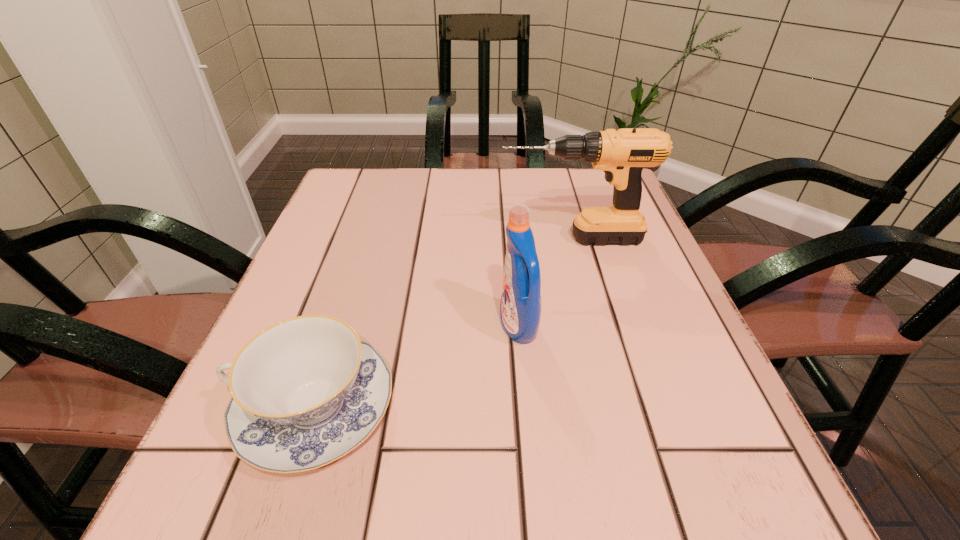
I want to click on object that is at the near edge, so click(x=306, y=391).

Locate an element on the screen. object situated at the left edge is located at coordinates coord(306,391).

Identify the location of object that is positioned at the right edge. (622, 155).

Locate an element on the screen. The width and height of the screenshot is (960, 540). object present at the near left corner is located at coordinates (306, 391).

At what (x,y) coordinates should I click in order to perform the action: click on vacant space at the far edge of the desktop. Please return your answer as a coordinate pair (x, y). The height and width of the screenshot is (540, 960). Looking at the image, I should click on (540, 195).

At what (x,y) coordinates should I click in order to perform the action: click on vacant space at the left edge of the desktop. Please return your answer as a coordinate pair (x, y). The width and height of the screenshot is (960, 540). Looking at the image, I should click on (309, 259).

You are a GUI agent. You are given a task and a screenshot of the screen. Output one action in this format:
    pyautogui.click(x=<x>, y=<y>)
    Task: Click on the free space at the right edge of the desktop
    
    Given the screenshot: What is the action you would take?
    pyautogui.click(x=678, y=293)

You are a GUI agent. You are given a task and a screenshot of the screen. Output one action in this format:
    pyautogui.click(x=<x>, y=<y>)
    Task: Click on the vacant area at the far left corner
    The height and width of the screenshot is (540, 960).
    Given the screenshot: What is the action you would take?
    pyautogui.click(x=375, y=179)

Where is `vacant space at the near left corner of the desktop`? This screenshot has width=960, height=540. vacant space at the near left corner of the desktop is located at coordinates (228, 500).

You are a GUI agent. You are given a task and a screenshot of the screen. Output one action in this format:
    pyautogui.click(x=<x>, y=<y>)
    Task: Click on the free spot at the far right corner of the desktop
    Image resolution: width=960 pixels, height=540 pixels.
    Given the screenshot: What is the action you would take?
    pyautogui.click(x=582, y=205)